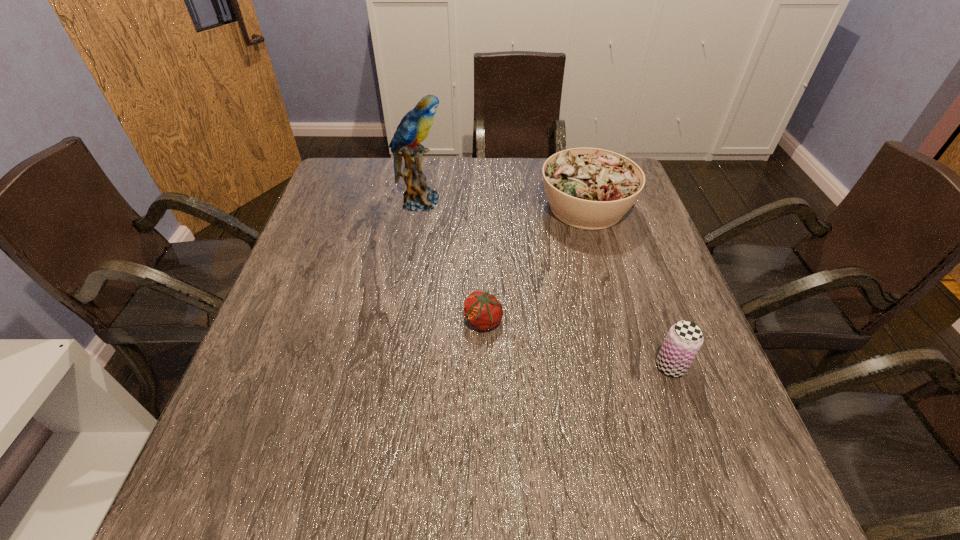
The width and height of the screenshot is (960, 540). I want to click on free location that satisfies the following two spatial constraints: 1. on the face of the leftmost object; 2. on the right side of the salad, so click(x=419, y=207).

This screenshot has width=960, height=540. I want to click on vacant area that satisfies the following two spatial constraints: 1. on the front side of the salad; 2. on the right side of the beer can, so click(632, 366).

Where is `vacant space that satisfies the following two spatial constraints: 1. on the face of the beer can; 2. on the right side of the parrot`? vacant space that satisfies the following two spatial constraints: 1. on the face of the beer can; 2. on the right side of the parrot is located at coordinates (393, 366).